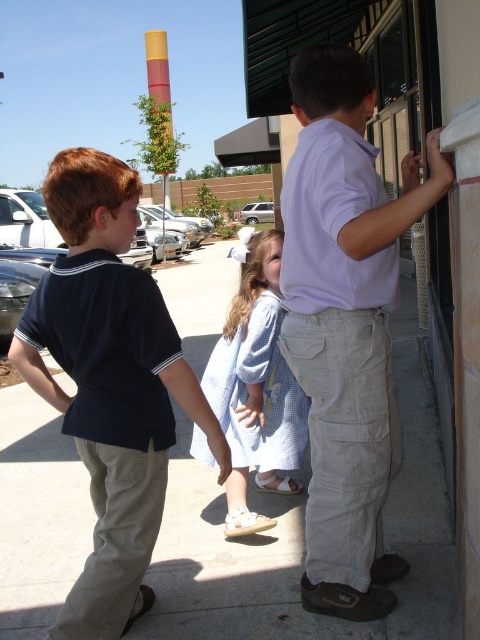
Question: Does light gray concrete pavement at center appear on the left side of light purple shirt at upper right?

Choices:
 (A) yes
 (B) no

Answer: (A)

Question: Does dark blue cotton shirt at left come in front of light blue cotton dress at center?

Choices:
 (A) no
 (B) yes

Answer: (B)

Question: Which point is farther to the camera?

Choices:
 (A) (383, 248)
 (B) (87, 308)

Answer: (B)

Question: Estimate the real-world distances between objects in this image. Which object is farther from the light purple shirt at upper right?

Choices:
 (A) light blue cotton dress at center
 (B) dark blue cotton shirt at left

Answer: (A)

Question: Is light gray concrete pavement at center behind dark blue cotton shirt at left?

Choices:
 (A) no
 (B) yes

Answer: (B)

Question: Which point is farther from the camera taking this photo?

Choices:
 (A) (117, 580)
 (B) (370, 348)
 (C) (217, 573)

Answer: (C)